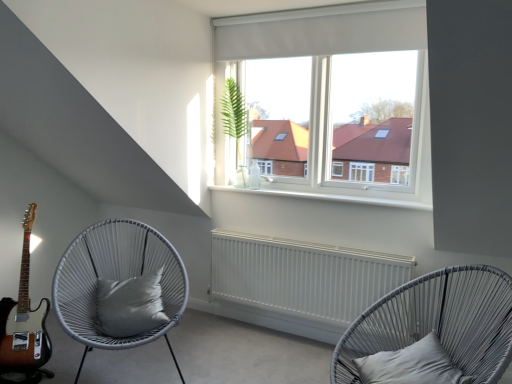
Question: Is matte grey wicker chair at lower right, which is the 1th chair in right-to-left order, further to camera compared to green leafy plant at center?

Choices:
 (A) yes
 (B) no

Answer: (B)

Question: Does matte grey wicker chair at lower right, which is the second chair in left-to-right order, have a greater width compared to green leafy plant at center?

Choices:
 (A) yes
 (B) no

Answer: (A)

Question: Are matte grey wicker chair at lower right, which is the second chair in left-to-right order, and green leafy plant at center far apart?

Choices:
 (A) no
 (B) yes

Answer: (B)

Question: Considering the relative positions of matte grey wicker chair at lower right, which is the second chair in left-to-right order, and green leafy plant at center in the image provided, is matte grey wicker chair at lower right, which is the second chair in left-to-right order, in front of green leafy plant at center?

Choices:
 (A) no
 (B) yes

Answer: (B)

Question: Is matte grey wicker chair at lower right, which is the second chair in left-to-right order, beside green leafy plant at center?

Choices:
 (A) yes
 (B) no

Answer: (B)

Question: Does matte grey wicker chair at lower right, which is the second chair in left-to-right order, appear on the left side of green leafy plant at center?

Choices:
 (A) no
 (B) yes

Answer: (A)

Question: Can sunburst wood guitar at lower left be found inside white woven chair with cushion at left, the first chair when ordered from left to right?

Choices:
 (A) yes
 (B) no

Answer: (B)

Question: From a real-world perspective, is white woven chair with cushion at left, the first chair when ordered from left to right, below sunburst wood guitar at lower left?

Choices:
 (A) yes
 (B) no

Answer: (A)

Question: Is white woven chair with cushion at left, marked as the 2th chair in a right-to-left arrangement, bigger than sunburst wood guitar at lower left?

Choices:
 (A) yes
 (B) no

Answer: (A)

Question: From the image's perspective, is white woven chair with cushion at left, marked as the 2th chair in a right-to-left arrangement, beneath sunburst wood guitar at lower left?

Choices:
 (A) yes
 (B) no

Answer: (A)

Question: Does white woven chair with cushion at left, marked as the 2th chair in a right-to-left arrangement, have a lesser height compared to sunburst wood guitar at lower left?

Choices:
 (A) no
 (B) yes

Answer: (B)

Question: Is the position of white woven chair with cushion at left, marked as the 2th chair in a right-to-left arrangement, less distant than that of sunburst wood guitar at lower left?

Choices:
 (A) yes
 (B) no

Answer: (A)

Question: Does white woven chair with cushion at left, the first chair when ordered from left to right, touch white matte radiator at center?

Choices:
 (A) no
 (B) yes

Answer: (A)